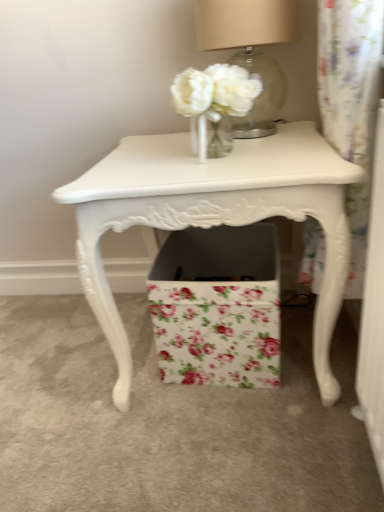
Question: Is white painted wood table at center a part of matte beige lampshade at upper center?

Choices:
 (A) yes
 (B) no

Answer: (B)

Question: Is the depth of matte beige lampshade at upper center greater than that of white painted wood table at center?

Choices:
 (A) yes
 (B) no

Answer: (A)

Question: Is matte beige lampshade at upper center to the right of white painted wood table at center from the viewer's perspective?

Choices:
 (A) no
 (B) yes

Answer: (B)

Question: Is matte beige lampshade at upper center next to white painted wood table at center and touching it?

Choices:
 (A) yes
 (B) no

Answer: (B)

Question: Considering the relative sizes of matte beige lampshade at upper center and white painted wood table at center in the image provided, is matte beige lampshade at upper center bigger than white painted wood table at center?

Choices:
 (A) yes
 (B) no

Answer: (B)

Question: In terms of width, does white painted wood table at center look wider or thinner when compared to matte beige lampshade at upper center?

Choices:
 (A) thin
 (B) wide

Answer: (B)

Question: Is white painted wood table at center in front of or behind matte beige lampshade at upper center in the image?

Choices:
 (A) front
 (B) behind

Answer: (A)

Question: Considering the relative positions of white painted wood table at center and matte beige lampshade at upper center in the image provided, is white painted wood table at center to the left or to the right of matte beige lampshade at upper center?

Choices:
 (A) left
 (B) right

Answer: (A)

Question: Considering the positions of point (84, 223) and point (259, 66), is point (84, 223) closer or farther from the camera than point (259, 66)?

Choices:
 (A) farther
 (B) closer

Answer: (B)

Question: Based on their positions, is matte beige lampshade at upper center located to the left or right of floral paper box at center?

Choices:
 (A) left
 (B) right

Answer: (B)

Question: From the image's perspective, relative to floral paper box at center, is matte beige lampshade at upper center above or below?

Choices:
 (A) below
 (B) above

Answer: (B)

Question: Is matte beige lampshade at upper center wider or thinner than floral paper box at center?

Choices:
 (A) thin
 (B) wide

Answer: (A)

Question: Is point (281, 87) positioned closer to the camera than point (238, 312)?

Choices:
 (A) closer
 (B) farther

Answer: (B)

Question: From a real-world perspective, relative to white painted wood table at center, is floral paper box at center vertically above or below?

Choices:
 (A) above
 (B) below

Answer: (B)

Question: Is floral paper box at center inside or outside of white painted wood table at center?

Choices:
 (A) outside
 (B) inside

Answer: (B)